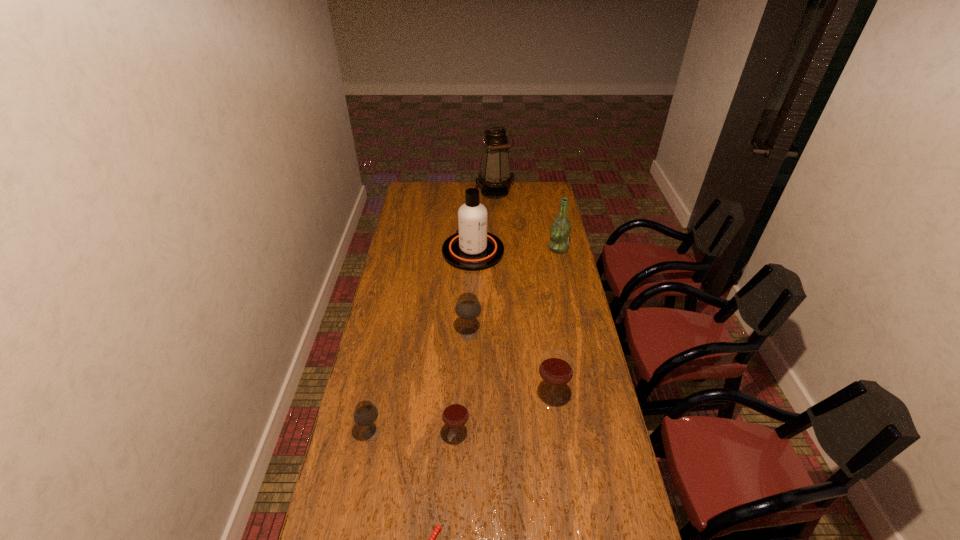
Locate an element on the screen. The height and width of the screenshot is (540, 960). the smaller red wineglass is located at coordinates 455,412.

I want to click on the nearer red wineglass, so click(x=455, y=412).

Identify the location of the smaller gray wineglass. Image resolution: width=960 pixels, height=540 pixels. (365, 413).

What are the coordinates of `the left gray wineglass` in the screenshot? It's located at coord(365,413).

Where is `vacant space located on the left of the brown oil lamp`? This screenshot has width=960, height=540. vacant space located on the left of the brown oil lamp is located at coordinates (447, 192).

The image size is (960, 540). In order to click on blank area located 0.170m on the back of the white cleansing agent in this screenshot , I will do `click(474, 215)`.

The width and height of the screenshot is (960, 540). Identify the location of vacant region located on the surface of the rightmost object. (478, 248).

Where is `vacant area located on the surface of the rightmost object`? This screenshot has width=960, height=540. vacant area located on the surface of the rightmost object is located at coordinates (539, 248).

This screenshot has width=960, height=540. I want to click on vacant space situated on the surface of the rightmost object, so click(497, 248).

Find the location of a particular element. Image resolution: width=960 pixels, height=540 pixels. vacant space situated 0.240m on the left of the bigger red wineglass is located at coordinates (468, 399).